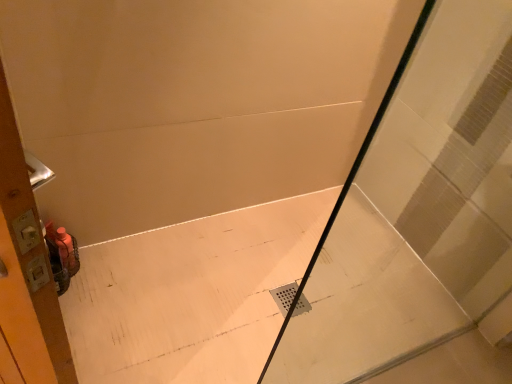
The height and width of the screenshot is (384, 512). I want to click on vacant area situated to the left side of transparent glass door at center, so coord(225,330).